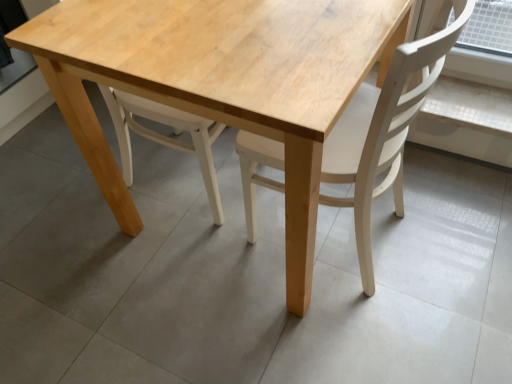
Locate an element on the screen. vacant area that is in front of natural wood table at center is located at coordinates (275, 336).